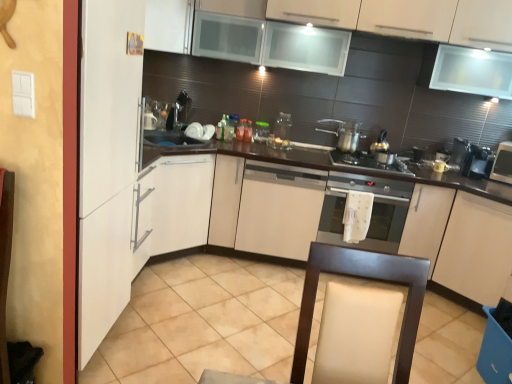
Question: From a real-world perspective, is leather-like beige swivel chair at lower center under metallic silver coffee machine at right, which is the first coffee machine in left-to-right order?

Choices:
 (A) no
 (B) yes

Answer: (B)

Question: Is leather-like beige swivel chair at lower center shorter than metallic silver coffee machine at right, placed as the 2th coffee machine when sorted from right to left?

Choices:
 (A) yes
 (B) no

Answer: (B)

Question: Can you confirm if leather-like beige swivel chair at lower center is wider than metallic silver coffee machine at right, which is the first coffee machine in left-to-right order?

Choices:
 (A) yes
 (B) no

Answer: (A)

Question: Does leather-like beige swivel chair at lower center have a greater height compared to metallic silver coffee machine at right, which is the first coffee machine in left-to-right order?

Choices:
 (A) yes
 (B) no

Answer: (A)

Question: From the image's perspective, does leather-like beige swivel chair at lower center appear higher than metallic silver coffee machine at right, which is the first coffee machine in left-to-right order?

Choices:
 (A) yes
 (B) no

Answer: (B)

Question: Considering the relative positions of leather-like beige swivel chair at lower center and metallic silver coffee machine at right, placed as the 2th coffee machine when sorted from right to left, in the image provided, is leather-like beige swivel chair at lower center to the left of metallic silver coffee machine at right, placed as the 2th coffee machine when sorted from right to left, from the viewer's perspective?

Choices:
 (A) yes
 (B) no

Answer: (A)

Question: Is white matte cabinet at center, the 3th cabinetry viewed from the top, far from metallic silver gas stove at center?

Choices:
 (A) no
 (B) yes

Answer: (A)

Question: Is white matte cabinet at center, which appears as the 2th cabinetry when ordered from the bottom, directly adjacent to metallic silver gas stove at center?

Choices:
 (A) yes
 (B) no

Answer: (B)

Question: Considering the relative sizes of white matte cabinet at center, the 3th cabinetry viewed from the top, and metallic silver gas stove at center in the image provided, is white matte cabinet at center, the 3th cabinetry viewed from the top, thinner than metallic silver gas stove at center?

Choices:
 (A) yes
 (B) no

Answer: (B)

Question: From a real-world perspective, is white matte cabinet at center, the 3th cabinetry viewed from the top, over metallic silver gas stove at center?

Choices:
 (A) yes
 (B) no

Answer: (B)

Question: Does white matte cabinet at center, which appears as the 2th cabinetry when ordered from the bottom, have a greater width compared to metallic silver gas stove at center?

Choices:
 (A) yes
 (B) no

Answer: (A)

Question: Does white matte cabinet at center, the 3th cabinetry viewed from the top, have a greater height compared to metallic silver gas stove at center?

Choices:
 (A) yes
 (B) no

Answer: (A)

Question: Is white matte cabinet at upper left, the fourth cabinetry from the bottom, with satin silver oven at center?

Choices:
 (A) no
 (B) yes

Answer: (A)